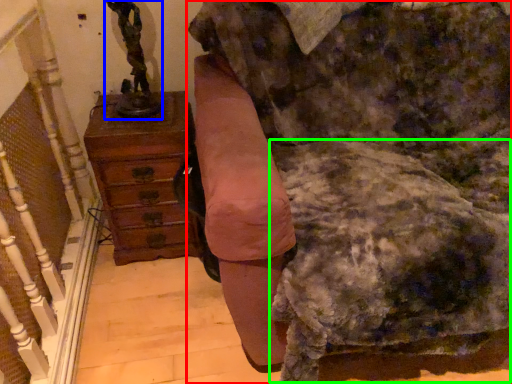
Question: Estimate the real-world distances between objects in this image. Which object is closer to furniture (highlighted by a red box), sculpture (highlighted by a blue box) or swivel chair (highlighted by a green box)?

Choices:
 (A) sculpture
 (B) swivel chair

Answer: (B)